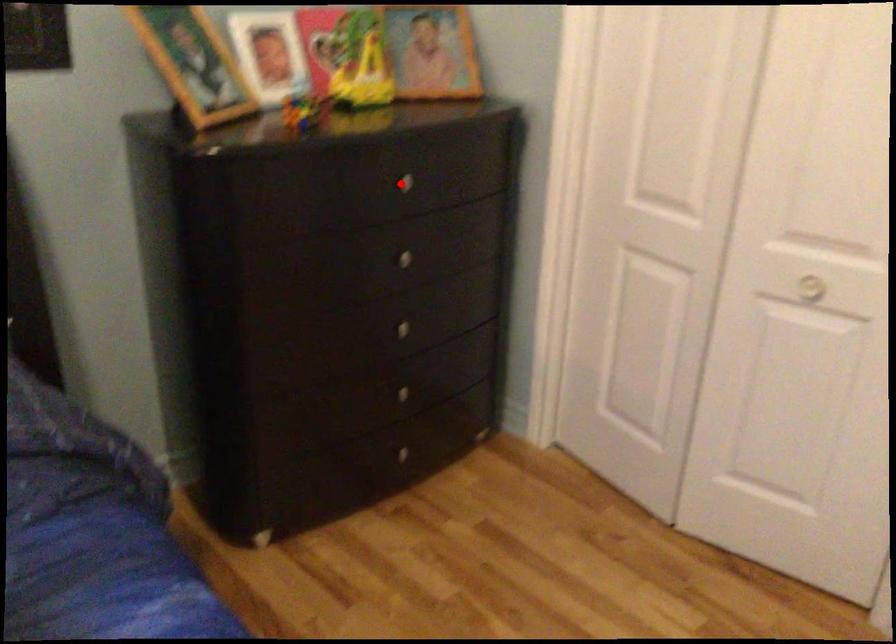
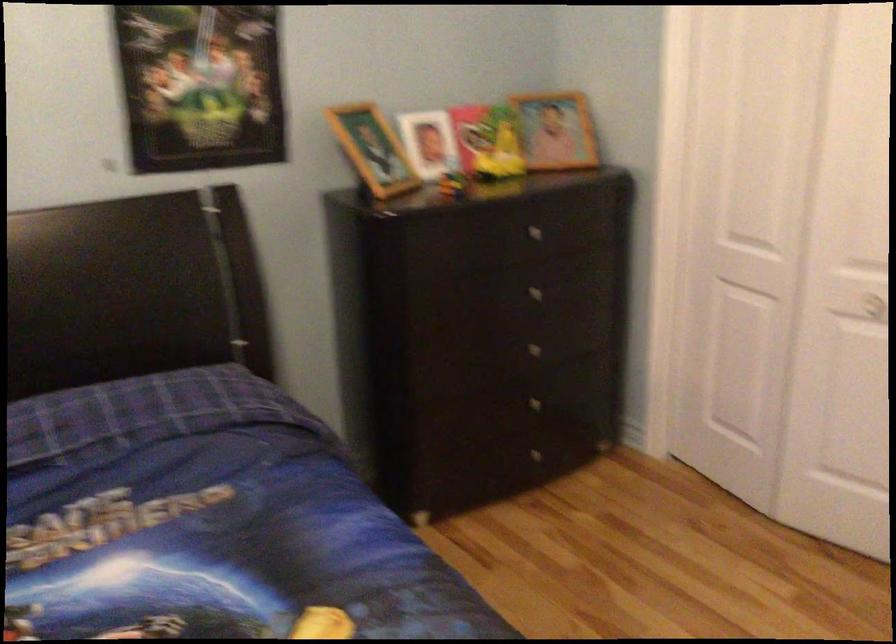
The point at the highlighted location is marked in the first image. Where is the corresponding point in the second image?

(530, 230)